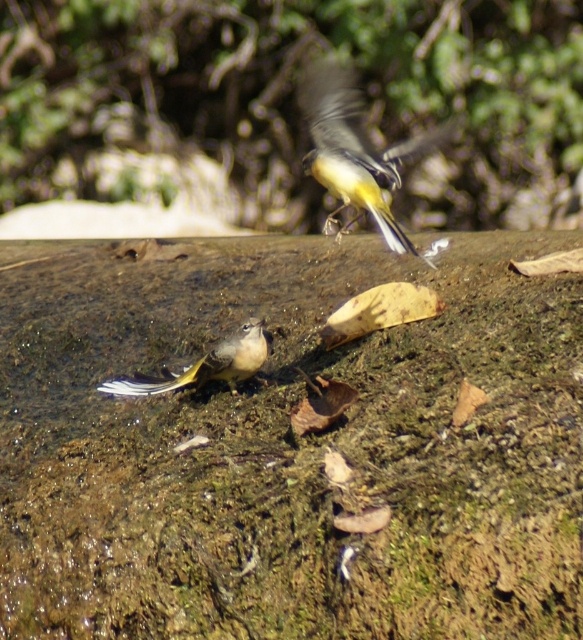
You are a hiker who wants to take a photo of the yellowish underside bird. You are currently standing at point (x=353, y=148). Which direction should you move to get a better shot of the yellowish underside bird?

The yellowish underside bird is the bird at point (x=353, y=148), so you are already positioned directly at that location. You can adjust your angle slightly to capture the yellowish underside more clearly.